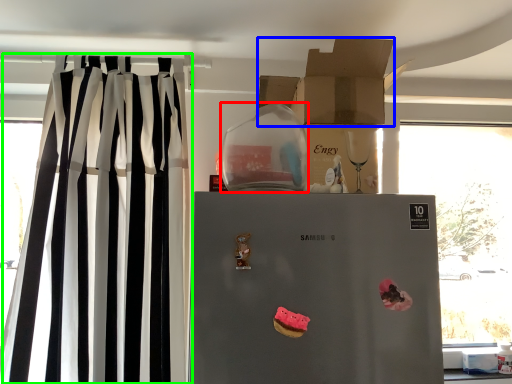
Question: Which is farther away from appliance (highlighted by a red box)? cardboard box (highlighted by a blue box) or curtain (highlighted by a green box)?

Choices:
 (A) cardboard box
 (B) curtain

Answer: (B)